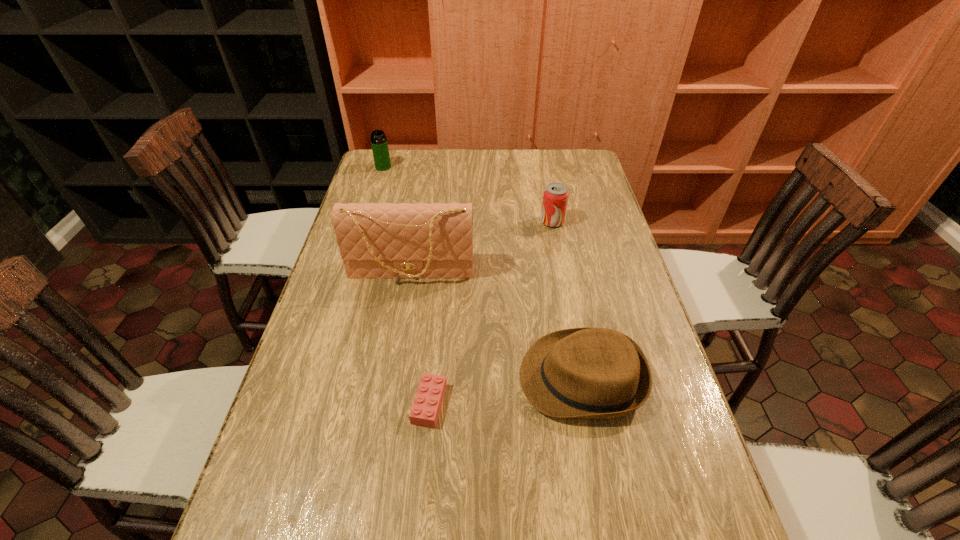
Where is `object located in the far left corner section of the desktop`? The image size is (960, 540). object located in the far left corner section of the desktop is located at coordinates (379, 144).

In the image, there is a desktop. Where is `vacant area at the far edge`? The image size is (960, 540). vacant area at the far edge is located at coordinates (518, 154).

Identify the location of free space at the right edge of the desktop. The width and height of the screenshot is (960, 540). (674, 471).

The width and height of the screenshot is (960, 540). What are the coordinates of `vacant point at the far left corner` in the screenshot? It's located at (393, 151).

Find the location of a particular element. The image size is (960, 540). vacant position at the far right corner of the desktop is located at coordinates (594, 177).

At what (x,y) coordinates should I click in order to perform the action: click on vacant area that lies between the tallest object and the fedora. Please return your answer as a coordinate pair (x, y). The width and height of the screenshot is (960, 540). Looking at the image, I should click on (496, 325).

Locate an element on the screen. The height and width of the screenshot is (540, 960). free area in between the second shortest object and the third shortest object is located at coordinates (567, 300).

Image resolution: width=960 pixels, height=540 pixels. Identify the location of vacant space that's between the fedora and the Lego. (506, 391).

Find the location of `vacant point located between the shortest object and the thermos bottle`. vacant point located between the shortest object and the thermos bottle is located at coordinates (406, 285).

You are a GUI agent. You are given a task and a screenshot of the screen. Output one action in this format:
    pyautogui.click(x=<x>, y=<y>)
    Task: Click on the vacant space that is in between the soda can and the shortest object
    This screenshot has height=540, width=960.
    Given the screenshot: What is the action you would take?
    pyautogui.click(x=491, y=313)